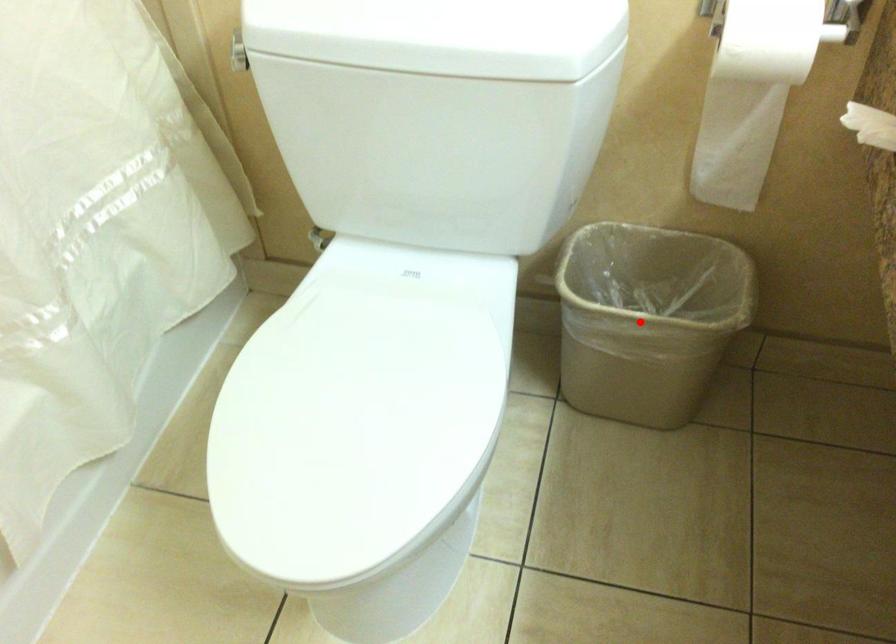
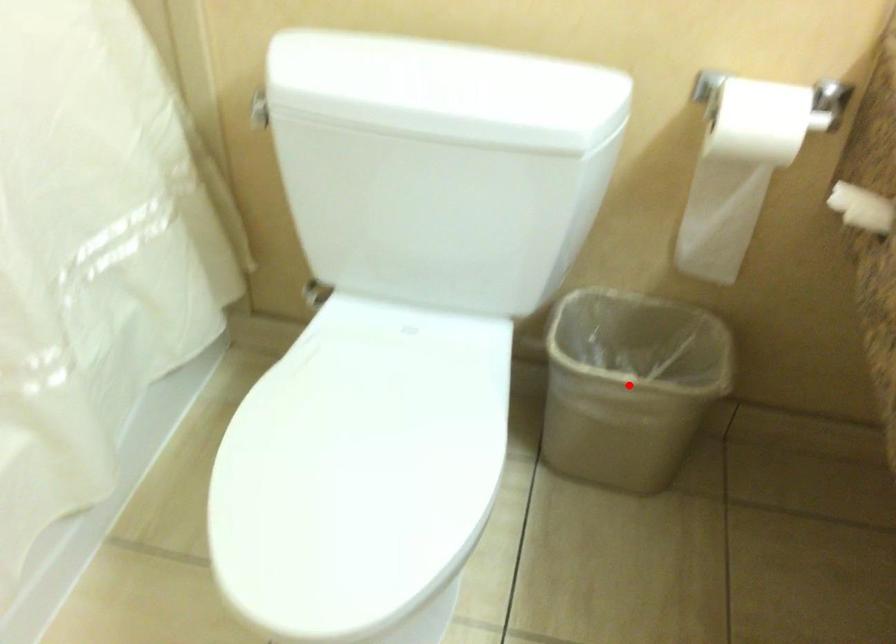
I am providing you with two images of the same scene from different viewpoints. A red point is marked on the first image and another point is marked on the second image. Does the point marked in image1 correspond to the same location as the one in image2?

Yes